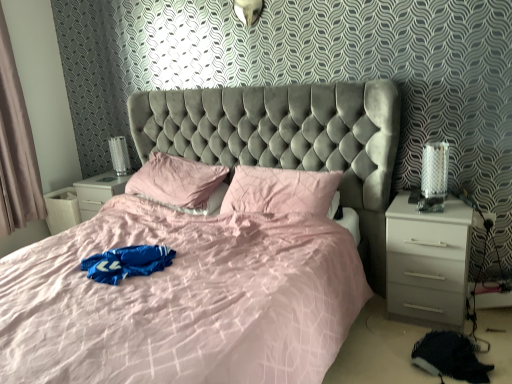
The image size is (512, 384). Identify the location of metallic silver table lamp at left, the 1th table lamp from the back. (119, 155).

This screenshot has width=512, height=384. What do you see at coordinates (119, 155) in the screenshot? I see `metallic silver table lamp at left, placed as the 1th table lamp when sorted from left to right` at bounding box center [119, 155].

Describe the element at coordinates (426, 262) in the screenshot. I see `white glossy nightstand at right` at that location.

The width and height of the screenshot is (512, 384). Describe the element at coordinates (449, 357) in the screenshot. I see `black fuzzy blanket at lower right` at that location.

Where is `metallic silver table lamp at left, the 1th table lamp from the back`? metallic silver table lamp at left, the 1th table lamp from the back is located at coordinates (119, 155).

Considering the relative sizes of metallic silver table lamp at left, the 2th table lamp when ordered from front to back, and black fuzzy blanket at lower right in the image provided, is metallic silver table lamp at left, the 2th table lamp when ordered from front to back, wider than black fuzzy blanket at lower right?

Incorrect, the width of metallic silver table lamp at left, the 2th table lamp when ordered from front to back, does not surpass that of black fuzzy blanket at lower right.

How much distance is there between metallic silver table lamp at left, which is the second table lamp in right-to-left order, and black fuzzy blanket at lower right?

metallic silver table lamp at left, which is the second table lamp in right-to-left order, is 8.24 feet away from black fuzzy blanket at lower right.

Considering the sizes of objects metallic silver table lamp at left, placed as the 1th table lamp when sorted from left to right, and black fuzzy blanket at lower right in the image provided, who is taller, metallic silver table lamp at left, placed as the 1th table lamp when sorted from left to right, or black fuzzy blanket at lower right?

metallic silver table lamp at left, placed as the 1th table lamp when sorted from left to right.

Is metallic silver table lamp at left, the 2th table lamp when ordered from front to back, closer to the viewer compared to black fuzzy blanket at lower right?

No, metallic silver table lamp at left, the 2th table lamp when ordered from front to back, is further to the viewer.

Choose the correct answer: Is black fuzzy blanket at lower right inside light beige fabric curtain at left or outside it?

The correct answer is: outside.

How different are the orientations of black fuzzy blanket at lower right and light beige fabric curtain at left in degrees?

The facing directions of black fuzzy blanket at lower right and light beige fabric curtain at left are 89.7 degrees apart.

Which is more to the left, black fuzzy blanket at lower right or light beige fabric curtain at left?

From the viewer's perspective, light beige fabric curtain at left appears more on the left side.

Which object is more forward, black fuzzy blanket at lower right or light beige fabric curtain at left?

black fuzzy blanket at lower right is closer to the camera.

Between white glossy nightstand at right and metallic silver table lamp at left, the 2th table lamp when ordered from front to back, which one appears on the right side from the viewer's perspective?

white glossy nightstand at right is more to the right.

Is white glossy nightstand at right next to metallic silver table lamp at left, which is the second table lamp in right-to-left order?

No, white glossy nightstand at right is not touching metallic silver table lamp at left, which is the second table lamp in right-to-left order.

Considering the sizes of objects white glossy nightstand at right and metallic silver table lamp at left, the 1th table lamp from the back, in the image provided, who is bigger, white glossy nightstand at right or metallic silver table lamp at left, the 1th table lamp from the back,?

white glossy nightstand at right is bigger.

From the image's perspective, is white glossy nightstand at right above or below black fuzzy blanket at lower right?

From the image's perspective, white glossy nightstand at right appears above black fuzzy blanket at lower right.

Looking at this image, which is correct: white glossy nightstand at right is inside black fuzzy blanket at lower right, or outside of it?

white glossy nightstand at right is not enclosed by black fuzzy blanket at lower right.

Which object is wider, white glossy nightstand at right or black fuzzy blanket at lower right?

white glossy nightstand at right is wider.

Consider the image. Is pink fabric pillow at center turned away from black fuzzy blanket at lower right?

pink fabric pillow at center does not have its back to black fuzzy blanket at lower right.

Considering the sizes of objects pink fabric pillow at center and black fuzzy blanket at lower right in the image provided, who is shorter, pink fabric pillow at center or black fuzzy blanket at lower right?

black fuzzy blanket at lower right.

From the image's perspective, which one is positioned higher, metallic silver table lamp at left, placed as the 1th table lamp when sorted from left to right, or pink fabric pillow at center?

metallic silver table lamp at left, placed as the 1th table lamp when sorted from left to right.

Does metallic silver table lamp at left, the 2th table lamp when ordered from front to back, come behind pink fabric pillow at center?

That is True.

From a real-world perspective, who is located lower, metallic silver table lamp at left, the 1th table lamp from the back, or pink fabric pillow at center?

pink fabric pillow at center, from a real-world perspective.

Is metallic silver table lamp at left, which is the second table lamp in right-to-left order, not inside pink fabric pillow at center?

Absolutely, metallic silver table lamp at left, which is the second table lamp in right-to-left order, is external to pink fabric pillow at center.

In the scene shown: Does metallic silver table lamp at left, placed as the 1th table lamp when sorted from left to right, have a larger size compared to light beige fabric curtain at left?

Incorrect, metallic silver table lamp at left, placed as the 1th table lamp when sorted from left to right, is not larger than light beige fabric curtain at left.

Does point (115, 168) come farther from viewer compared to point (5, 25)?

Yes, point (115, 168) is behind point (5, 25).

Can you confirm if metallic silver table lamp at left, placed as the 1th table lamp when sorted from left to right, is wider than light beige fabric curtain at left?

No.

How much distance is there between metallic silver table lamp at left, the 2th table lamp when ordered from front to back, and light beige fabric curtain at left?

metallic silver table lamp at left, the 2th table lamp when ordered from front to back, is 71.93 centimeters from light beige fabric curtain at left.

From the image's perspective, count 2nd table lamps upward from the black fuzzy blanket at lower right and point to it. Please provide its 2D coordinates.

[(119, 155)]

The height and width of the screenshot is (384, 512). In order to click on curtain behind the black fuzzy blanket at lower right in this screenshot , I will do click(x=16, y=148).

Based on the photo, when comparing their distances from light beige fabric curtain at left, does velvet grey bed at center or white glossy nightstand at right seem further?

The object further to light beige fabric curtain at left is white glossy nightstand at right.

Based on their spatial positions, is metallic silver table lamp at right, which is the second table lamp from back to front, or light beige fabric curtain at left closer to white glossy nightstand at right?

Based on the image, metallic silver table lamp at right, which is the second table lamp from back to front, appears to be nearer to white glossy nightstand at right.

Based on their spatial positions, is white glossy nightstand at right or metallic silver table lamp at right, placed as the 1th table lamp when sorted from right to left, further from velvet grey bed at center?

metallic silver table lamp at right, placed as the 1th table lamp when sorted from right to left, lies further to velvet grey bed at center than the other object.

Based on their spatial positions, is metallic silver table lamp at left, placed as the 1th table lamp when sorted from left to right, or light beige fabric curtain at left further from black fuzzy blanket at lower right?

light beige fabric curtain at left lies further to black fuzzy blanket at lower right than the other object.

Based on their spatial positions, is light beige fabric curtain at left or metallic silver table lamp at right, which is the second table lamp from back to front, closer to velvet grey bed at center?

Among the two, metallic silver table lamp at right, which is the second table lamp from back to front, is located nearer to velvet grey bed at center.

Based on their spatial positions, is metallic silver table lamp at left, the 2th table lamp when ordered from front to back, or pink fabric pillow at center further from metallic silver table lamp at right, which is the second table lamp from back to front?

metallic silver table lamp at left, the 2th table lamp when ordered from front to back, is positioned further to the anchor metallic silver table lamp at right, which is the second table lamp from back to front.

From the image, which object appears to be farther from light beige fabric curtain at left, pink fabric pillow at center or metallic silver table lamp at left, which is the second table lamp in right-to-left order?

The object further to light beige fabric curtain at left is pink fabric pillow at center.

Estimate the real-world distances between objects in this image. Which object is further from metallic silver table lamp at left, which is the second table lamp in right-to-left order, pink fabric pillow at center or light beige fabric curtain at left?

pink fabric pillow at center is positioned further to the anchor metallic silver table lamp at left, which is the second table lamp in right-to-left order.

Where is `pillow between light beige fabric curtain at left and black fuzzy blanket at lower right in the horizontal direction`? Image resolution: width=512 pixels, height=384 pixels. pillow between light beige fabric curtain at left and black fuzzy blanket at lower right in the horizontal direction is located at coordinates (280, 191).

Identify the location of nightstand between metallic silver table lamp at right, the 1th table lamp in the front-to-back sequence, and black fuzzy blanket at lower right vertically. (426, 262).

The height and width of the screenshot is (384, 512). In order to click on nightstand between velvet grey bed at center and pink fabric pillow at center from front to back in this screenshot , I will do `click(426, 262)`.

The image size is (512, 384). In order to click on table lamp located between light beige fabric curtain at left and white glossy nightstand at right in the left-right direction in this screenshot , I will do tap(119, 155).